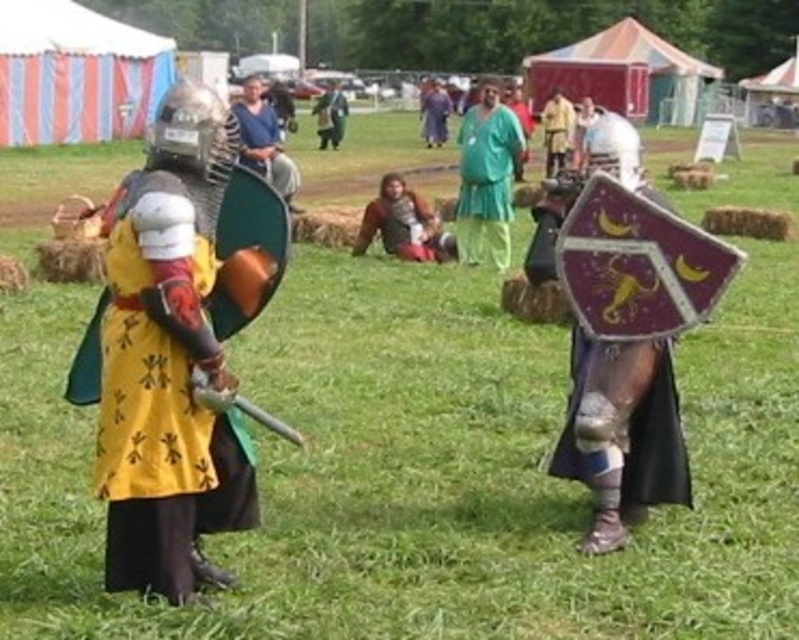
You are a spectator at a medieval festival and see two performers in the center of the image. One is wearing a yellow fabric tunic at center and the other a matte blue tunic at center. Which tunic is positioned to the right of the other?

The yellow fabric tunic at center is to the right of the matte blue tunic at center.

You are a medieval costume designer observing the mock battle scene. You need to determine the spatial arrangement of the costumes. Which object is positioned to the right of the other between the green fabric pants at center and the brown leather armor at center?

The green fabric pants at center are positioned to the right of the brown leather armor at center.